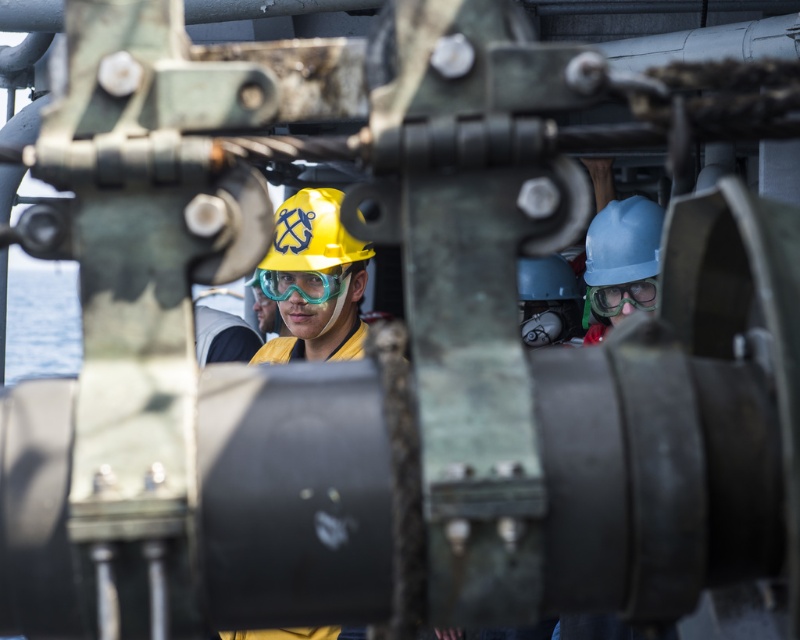
Question: Can you confirm if blue matte hard hat at center is positioned to the right of blue matte helmet at center?

Choices:
 (A) yes
 (B) no

Answer: (A)

Question: Where is blue matte helmet at center located in relation to transparent plastic goggles at center in the image?

Choices:
 (A) right
 (B) left

Answer: (B)

Question: Considering the real-world distances, which object is farthest from the transparent plastic goggles at center?

Choices:
 (A) yellow matte helmet at center
 (B) blue matte helmet at center
 (C) translucent plastic goggles at center
 (D) blue matte hard hat at center

Answer: (B)

Question: Does yellow matte helmet at center appear over transparent plastic goggles at center?

Choices:
 (A) no
 (B) yes

Answer: (B)

Question: Which of the following is the closest to the observer?

Choices:
 (A) blue matte helmet at center
 (B) translucent plastic goggles at center
 (C) yellow matte helmet at center
 (D) transparent plastic goggles at center

Answer: (B)

Question: Which of the following is the closest to the observer?

Choices:
 (A) blue matte helmet at center
 (B) yellow matte helmet at center
 (C) transparent plastic goggles at center
 (D) translucent plastic goggles at center

Answer: (D)